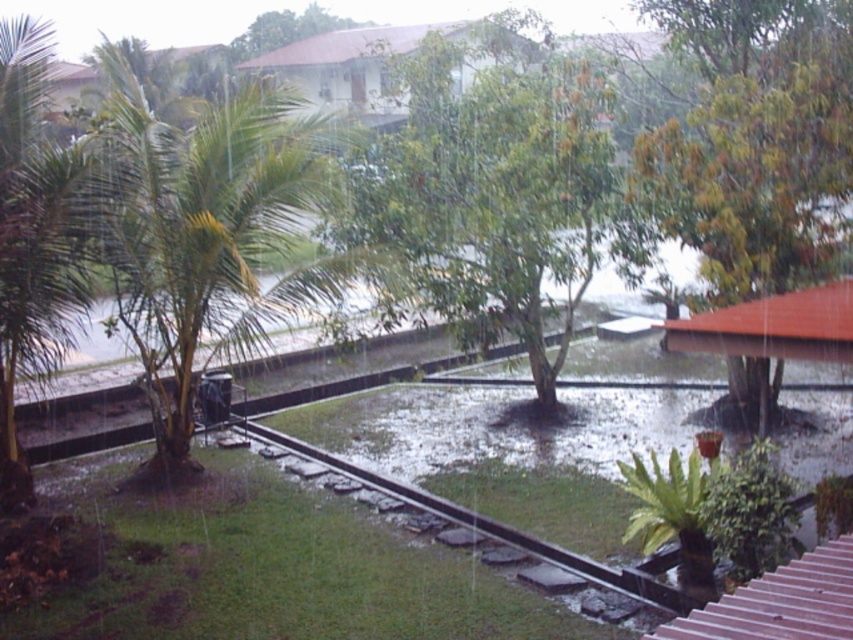
Identify the location of green leafy palm tree at left. This screenshot has width=853, height=640. [x=206, y=237].

Does point (457, 204) come closer to viewer compared to point (218, 348)?

No, it is not.

Who is positioned more to the left, green leafy tree at center or green leafy palm tree at left?

green leafy palm tree at left

Where is `green leafy tree at center`? This screenshot has width=853, height=640. green leafy tree at center is located at coordinates (495, 186).

Where is `green leafy tree at center`? This screenshot has height=640, width=853. green leafy tree at center is located at coordinates (495, 186).

Consider the image. Is green leafy tree at center below black metal train track at center?

Actually, green leafy tree at center is above black metal train track at center.

The width and height of the screenshot is (853, 640). What are the coordinates of `green leafy tree at center` in the screenshot? It's located at (495, 186).

Is point (370, 205) positioned behind point (631, 598)?

That is True.

This screenshot has height=640, width=853. I want to click on green leafy tree at center, so click(x=495, y=186).